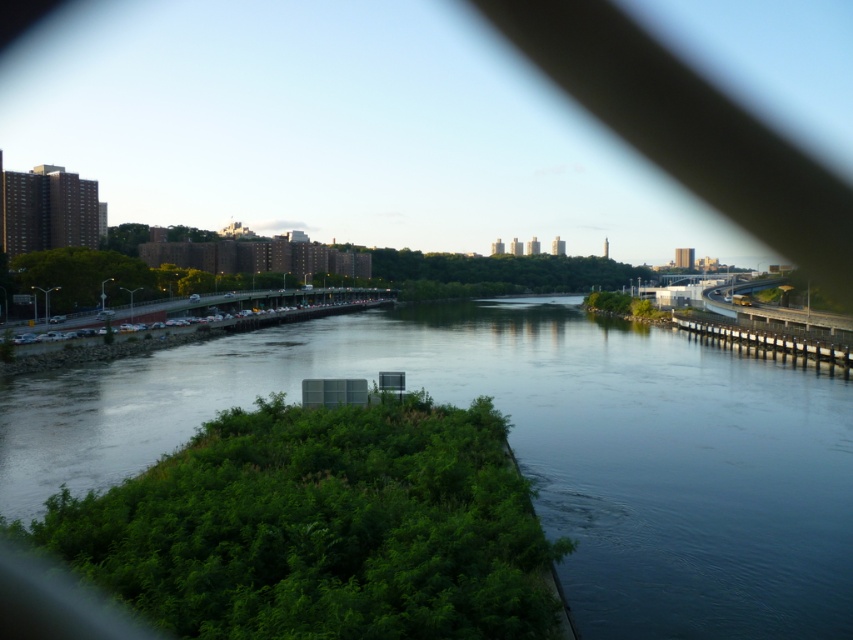
Is dark blue water at center taller than concrete bridge at right?

No, dark blue water at center is not taller than concrete bridge at right.

This screenshot has height=640, width=853. What do you see at coordinates (531, 449) in the screenshot? I see `dark blue water at center` at bounding box center [531, 449].

What do you see at coordinates (531, 449) in the screenshot? The image size is (853, 640). I see `dark blue water at center` at bounding box center [531, 449].

Locate an element on the screen. The height and width of the screenshot is (640, 853). dark blue water at center is located at coordinates (531, 449).